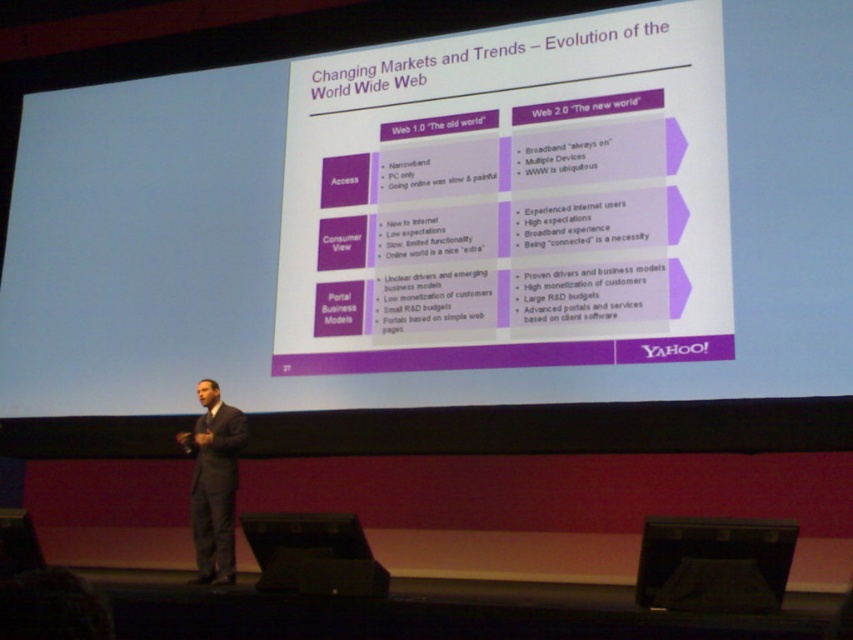
Question: Is black plastic speaker at lower center smaller than dark gray suit at center?

Choices:
 (A) yes
 (B) no

Answer: (A)

Question: Does white matte projection screen at upper center have a smaller size compared to black matte laptop at center?

Choices:
 (A) yes
 (B) no

Answer: (A)

Question: Which point appears closest to the camera in this image?

Choices:
 (A) (184, 438)
 (B) (360, 550)
 (C) (281, 33)

Answer: (B)

Question: Can you confirm if white matte projection screen at upper center is positioned to the left of black matte laptop at center?

Choices:
 (A) no
 (B) yes

Answer: (B)

Question: Which point is closer to the camera taking this photo?

Choices:
 (A) (212, 513)
 (B) (653, 564)
 (C) (325, 348)
 (D) (299, 518)

Answer: (B)

Question: Which of the following is the closest to the observer?

Choices:
 (A) (471, 208)
 (B) (737, 598)

Answer: (B)